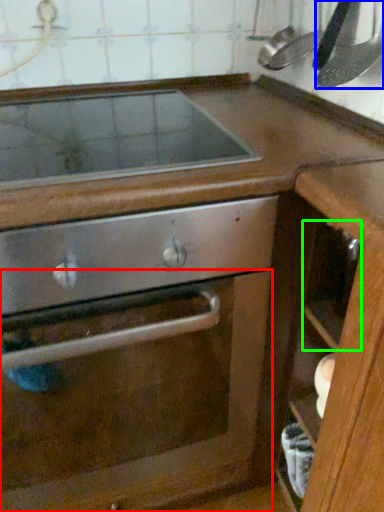
Question: Considering the real-world distances, which object is closest to glass door (highlighted by a red box)? kitchen appliance (highlighted by a blue box) or drawer (highlighted by a green box).

Choices:
 (A) kitchen appliance
 (B) drawer

Answer: (B)